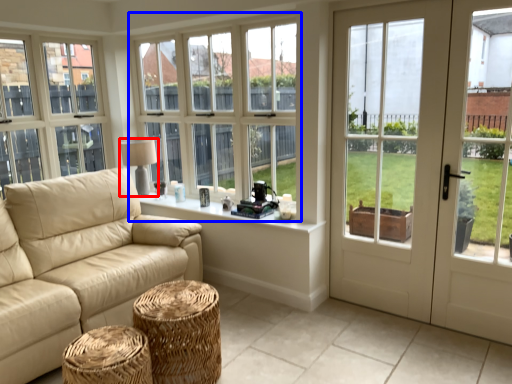
Question: Which point is further to the camera, table lamp (highlighted by a red box) or window (highlighted by a blue box)?

Choices:
 (A) table lamp
 (B) window

Answer: (A)